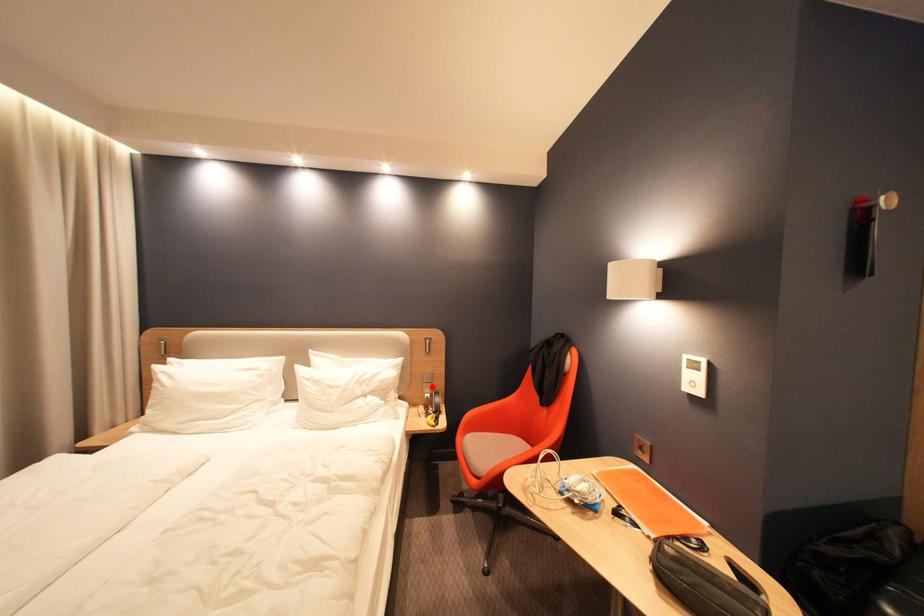
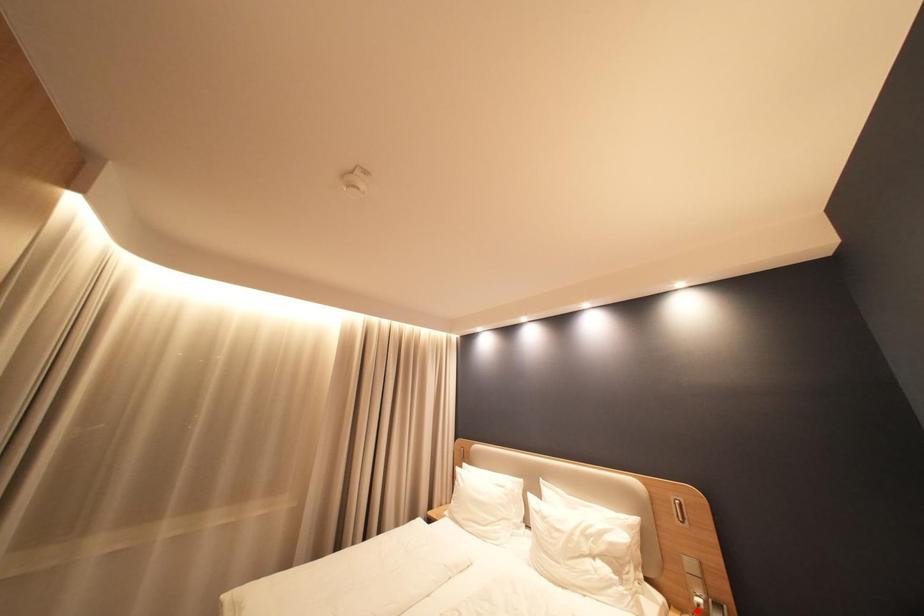
I am providing you with two images of the same scene from different viewpoints. A red point is marked on the first image and another point is marked on the second image. Do the highlighted points in image1 and image2 indicate the same real-world spot?

No